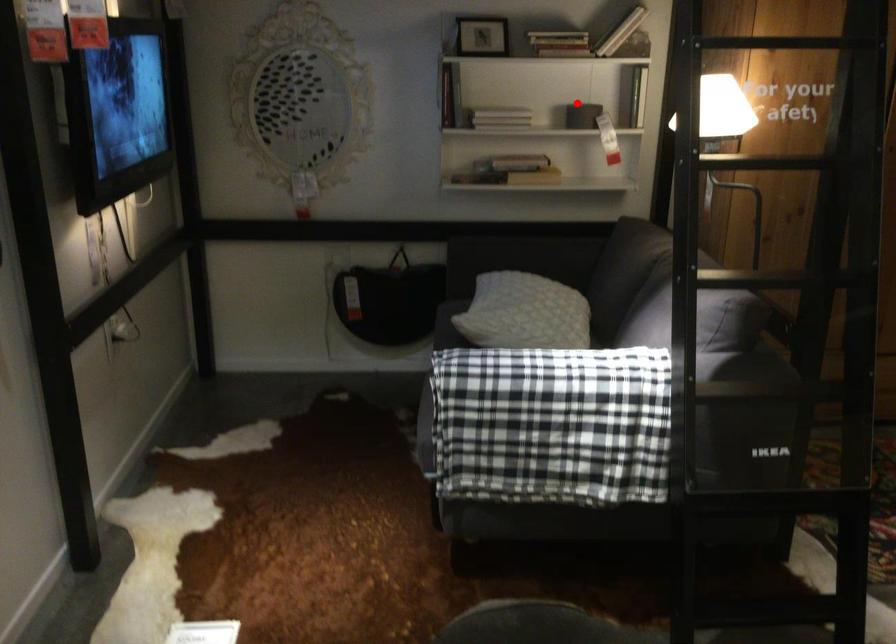
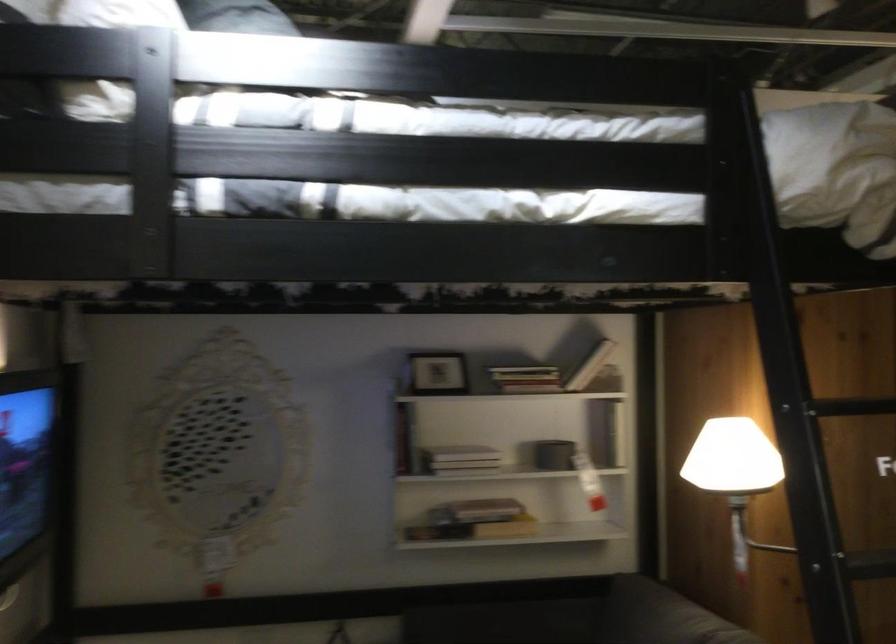
The point at the highlighted location is marked in the first image. Where is the corresponding point in the second image?

(553, 453)